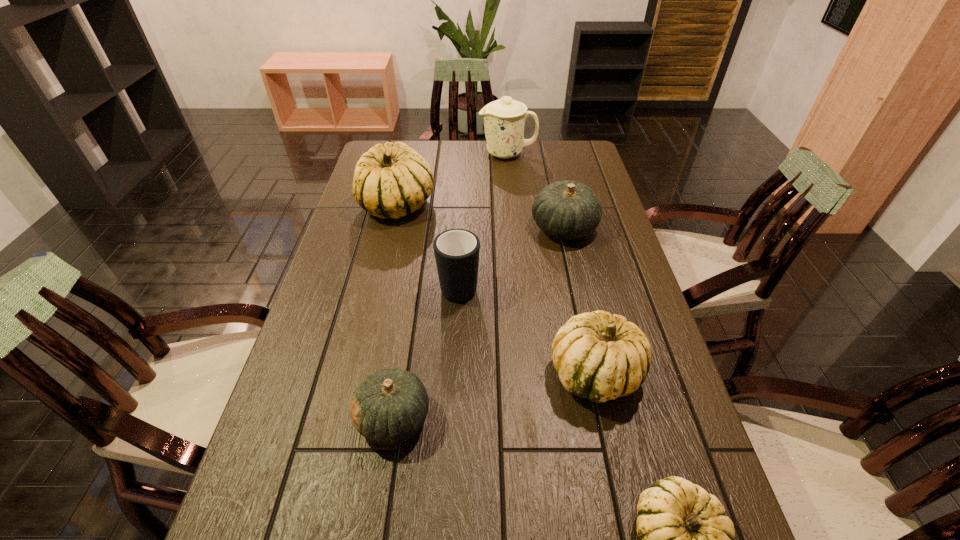
Identify the location of vacant space situated 0.370m on the spout of the farthest object. (387, 154).

Where is `free point located 0.150m on the spout of the farthest object`? The width and height of the screenshot is (960, 540). free point located 0.150m on the spout of the farthest object is located at coordinates (442, 154).

Locate an element on the screen. free location located on the right of the farthest white gourd is located at coordinates (499, 205).

Find the location of a particular element. Image resolution: width=960 pixels, height=540 pixels. free space located on the side of the fourth farthest object with the handle is located at coordinates (462, 220).

The image size is (960, 540). Find the location of `vacant space located on the side of the fourth farthest object with the handle`. vacant space located on the side of the fourth farthest object with the handle is located at coordinates (464, 189).

Find the location of a particular element. free space located on the side of the fourth farthest object with the handle is located at coordinates (463, 217).

Image resolution: width=960 pixels, height=540 pixels. What are the coordinates of `vacant area situated 0.100m on the front of the right orange gourd` in the screenshot? It's located at (573, 272).

This screenshot has width=960, height=540. Identify the location of vacant space located 0.200m on the left of the second smallest white gourd. (464, 374).

Locate an element on the screen. The width and height of the screenshot is (960, 540). blank area located on the right of the nearer orange gourd is located at coordinates (500, 418).

Find the location of a particular element. The width and height of the screenshot is (960, 540). object located in the far edge section of the desktop is located at coordinates (504, 119).